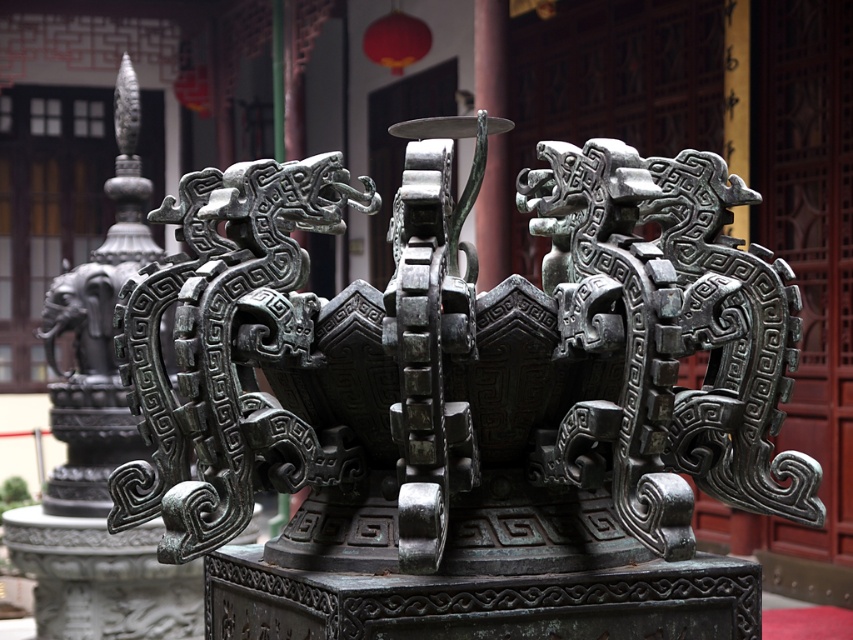
Question: Which point is farther to the camera?

Choices:
 (A) (96, 253)
 (B) (698, 253)

Answer: (A)

Question: Considering the relative positions of green patina bronze sculpture at center and bronze dragon head at left in the image provided, where is green patina bronze sculpture at center located with respect to bronze dragon head at left?

Choices:
 (A) left
 (B) right

Answer: (B)

Question: Does green patina bronze sculpture at center have a larger size compared to bronze dragon head at left?

Choices:
 (A) yes
 (B) no

Answer: (B)

Question: Is green patina bronze sculpture at center wider than bronze dragon head at left?

Choices:
 (A) yes
 (B) no

Answer: (A)